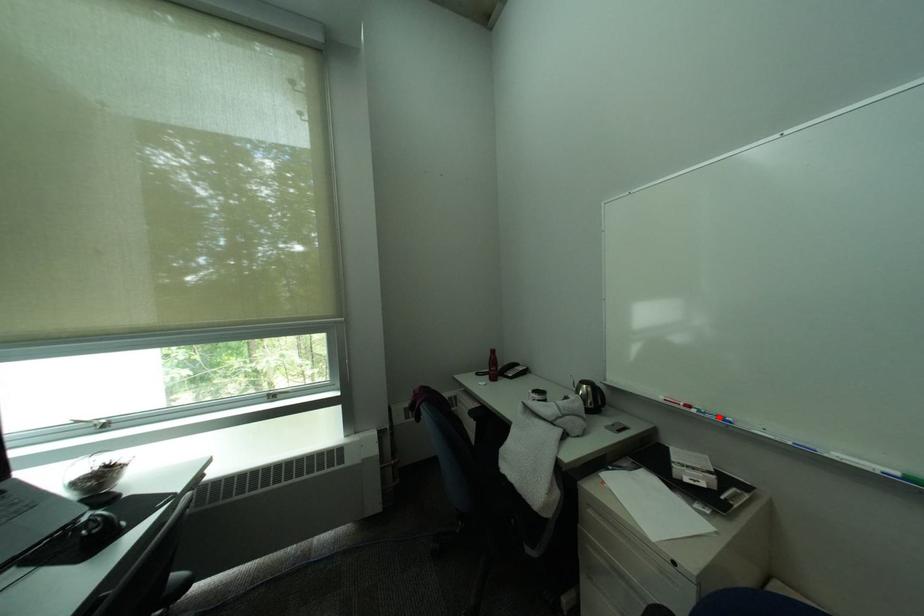
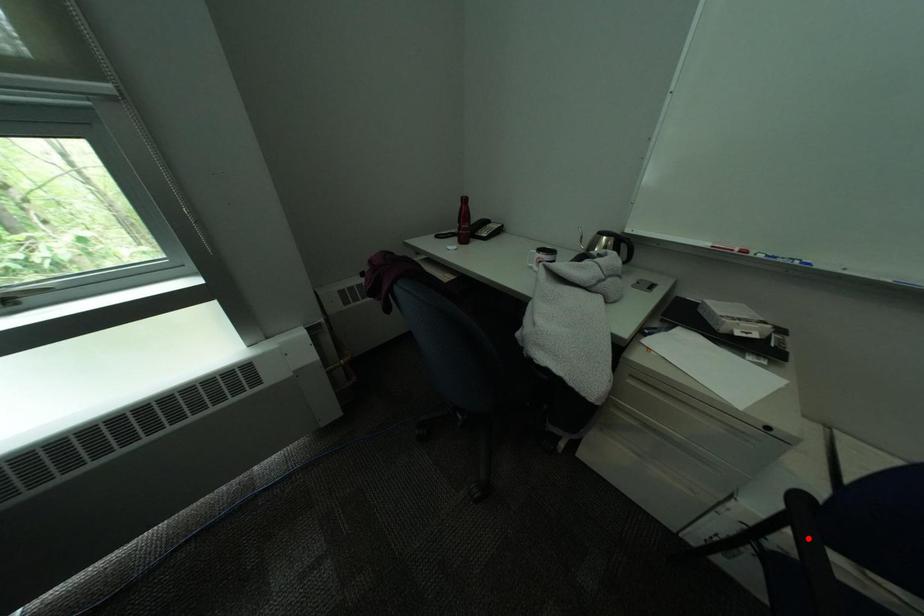
I am providing you with two images of the same scene from different viewpoints. A red point is marked on the first image and another point is marked on the second image. Is the marked point in image1 the same physical position as the marked point in image2?

No